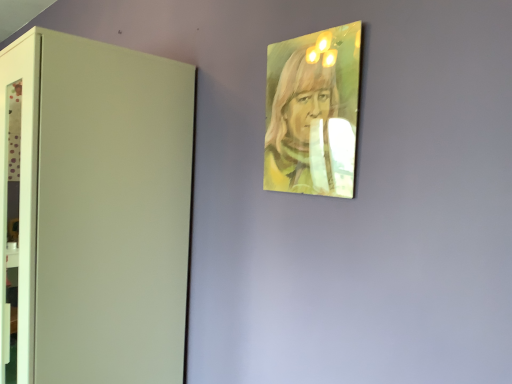
Image resolution: width=512 pixels, height=384 pixels. Describe the element at coordinates (308, 132) in the screenshot. I see `oil painting portrait at upper right` at that location.

Where is `oil painting portrait at upper right`? oil painting portrait at upper right is located at coordinates (308, 132).

Find the location of a particular element. This screenshot has width=512, height=384. oil painting portrait at upper right is located at coordinates (308, 132).